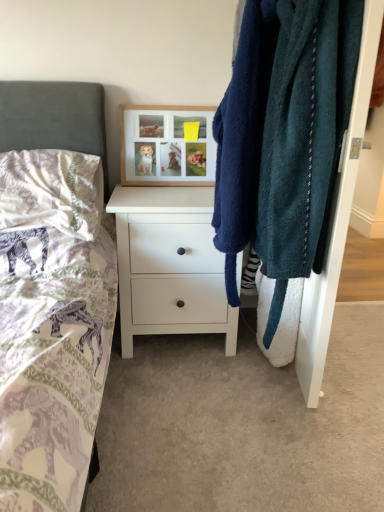
Question: Is point (127, 215) closer or farther from the camera than point (125, 124)?

Choices:
 (A) farther
 (B) closer

Answer: (B)

Question: Looking at the image, does white matte chest of drawers at center seem bigger or smaller compared to woodenobject at upper center?

Choices:
 (A) small
 (B) big

Answer: (B)

Question: Considering the real-world distances, which object is closest to the teal fuzzy robe at right?

Choices:
 (A) woodenobject at upper center
 (B) silky white pillow at left
 (C) white matte chest of drawers at center

Answer: (C)

Question: Which of these objects is positioned closest to the white matte chest of drawers at center?

Choices:
 (A) teal fuzzy robe at right
 (B) silky white pillow at left
 (C) woodenobject at upper center

Answer: (C)